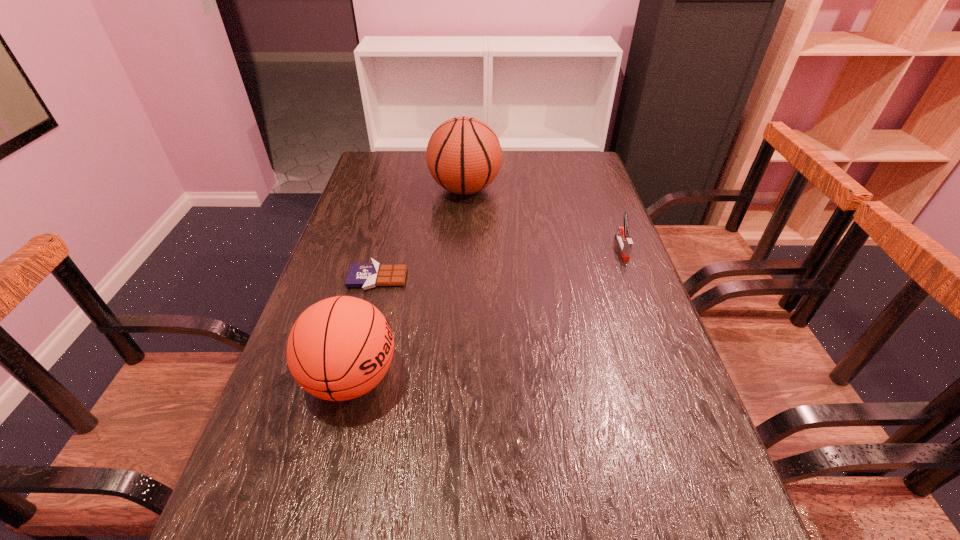
Locate an element on the screen. The width and height of the screenshot is (960, 540). vacant region that satisfies the following two spatial constraints: 1. on the handle side of the stapler; 2. on the side with logo of the nearer basketball is located at coordinates (672, 378).

Locate an element on the screen. This screenshot has width=960, height=540. vacant position in the image that satisfies the following two spatial constraints: 1. on the handle side of the third tallest object; 2. on the side with logo of the shorter basketball is located at coordinates (672, 378).

The height and width of the screenshot is (540, 960). Find the location of `vacant area that satisfies the following two spatial constraints: 1. on the side where the inflation valve is located; 2. on the front side of the shortest object`. vacant area that satisfies the following two spatial constraints: 1. on the side where the inflation valve is located; 2. on the front side of the shortest object is located at coordinates (461, 279).

You are a GUI agent. You are given a task and a screenshot of the screen. Output one action in this format:
    pyautogui.click(x=<x>, y=<y>)
    Task: Click on the free region that satisfies the following two spatial constraints: 1. on the handle side of the second shortest object; 2. on the side with logo of the nearest object
    Image resolution: width=960 pixels, height=540 pixels.
    Given the screenshot: What is the action you would take?
    pyautogui.click(x=672, y=378)